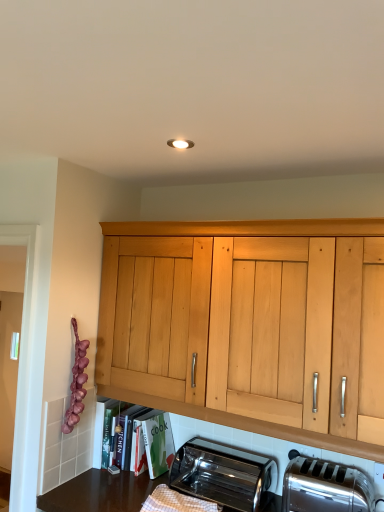
Find the location of `free spot above satin silver toaster at lower right, which appears as the 2th toaster when viewed from the left (from a real-world perspective)`. free spot above satin silver toaster at lower right, which appears as the 2th toaster when viewed from the left (from a real-world perspective) is located at coordinates (351, 462).